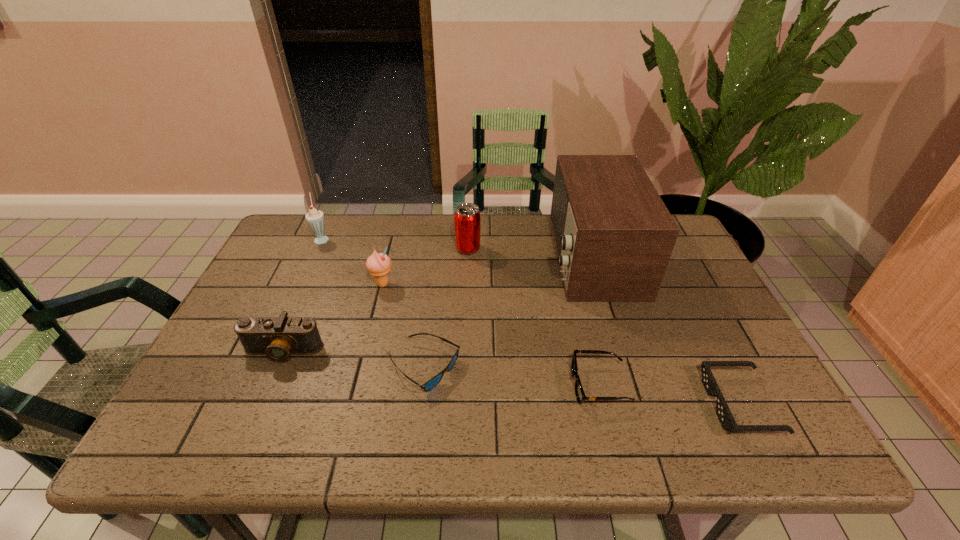
Where is `the tallest object`? The width and height of the screenshot is (960, 540). the tallest object is located at coordinates (614, 236).

Identify the location of soda can. This screenshot has height=540, width=960. (467, 218).

Locate an element on the screen. milkshake is located at coordinates (315, 218).

Identify the location of icecream. click(x=378, y=264).

Identify the location of the fifth shortest object. (378, 264).

This screenshot has width=960, height=540. Identify the location of the fifth tallest object. (279, 337).

Find the location of `the second sunglasses from left to right`. the second sunglasses from left to right is located at coordinates (579, 392).

Identify the location of the leftmost sunglasses. The height and width of the screenshot is (540, 960). (429, 385).

You are a GUI agent. You are given a task and a screenshot of the screen. Output one action in this format:
    pyautogui.click(x=<x>, y=<y>)
    Task: Click on the rightmost object
    
    Given the screenshot: What is the action you would take?
    pyautogui.click(x=727, y=421)

Identify the location of vacant region located on the front-facing side of the tallest object. (449, 256).